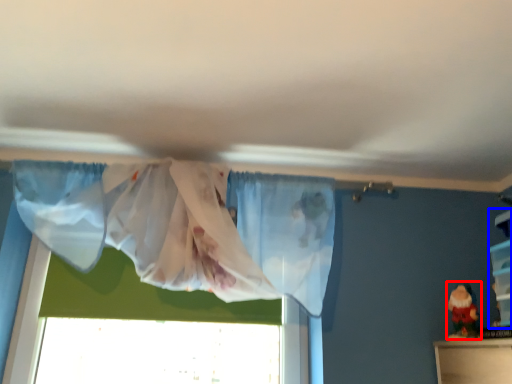
Question: Which of the following is the closest to the observer, toy (highlighted by a red box) or shelf (highlighted by a blue box)?

Choices:
 (A) toy
 (B) shelf

Answer: (B)